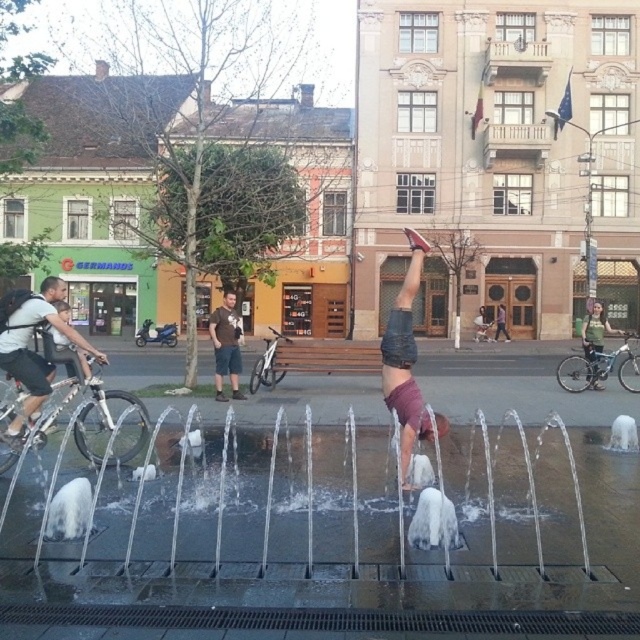
Who is taller, silver metallic bicycle at right or green fabric bag at lower right?

green fabric bag at lower right

Is silver metallic bicycle at right bigger than green fabric bag at lower right?

No, silver metallic bicycle at right is not bigger than green fabric bag at lower right.

Locate an element on the screen. silver metallic bicycle at right is located at coordinates (600, 369).

Identify the location of silver metallic bicycle at right. The height and width of the screenshot is (640, 640). (600, 369).

Does point (113, 458) lie in front of point (35, 371)?

No, it is behind (35, 371).

Does silver metallic bicycle at left have a greater height compared to matte black backpack at left?

No.

The width and height of the screenshot is (640, 640). What do you see at coordinates (97, 420) in the screenshot? I see `silver metallic bicycle at left` at bounding box center [97, 420].

Locate an element on the screen. The width and height of the screenshot is (640, 640). silver metallic bicycle at left is located at coordinates (97, 420).

Is denim shorts at center smaller than dark gray shorts at center?

Actually, denim shorts at center might be larger than dark gray shorts at center.

Is denim shorts at center thinner than dark gray shorts at center?

No, denim shorts at center is not thinner than dark gray shorts at center.

Between point (412, 320) and point (499, 317), which one is positioned in front?

Point (412, 320) is more forward.

The height and width of the screenshot is (640, 640). I want to click on denim shorts at center, so click(x=404, y=358).